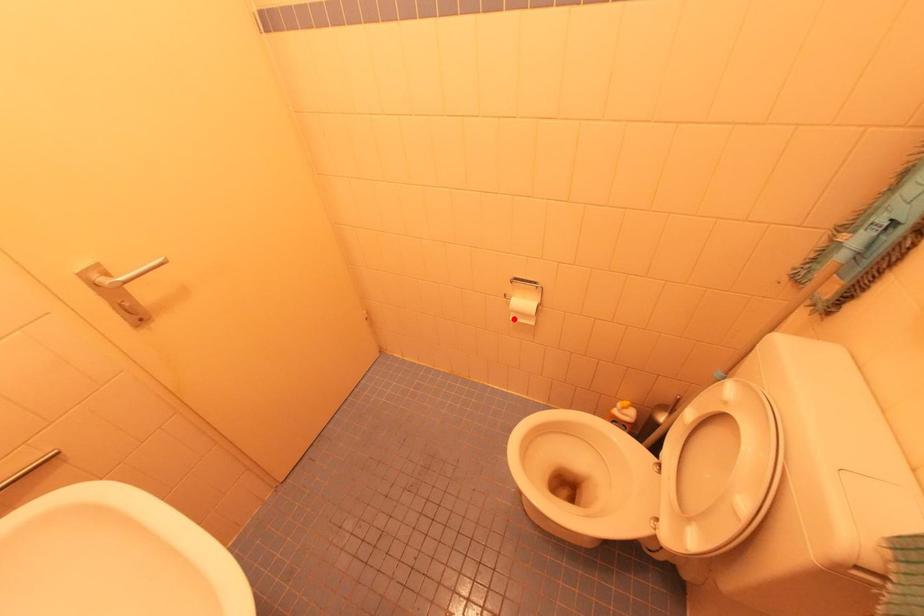
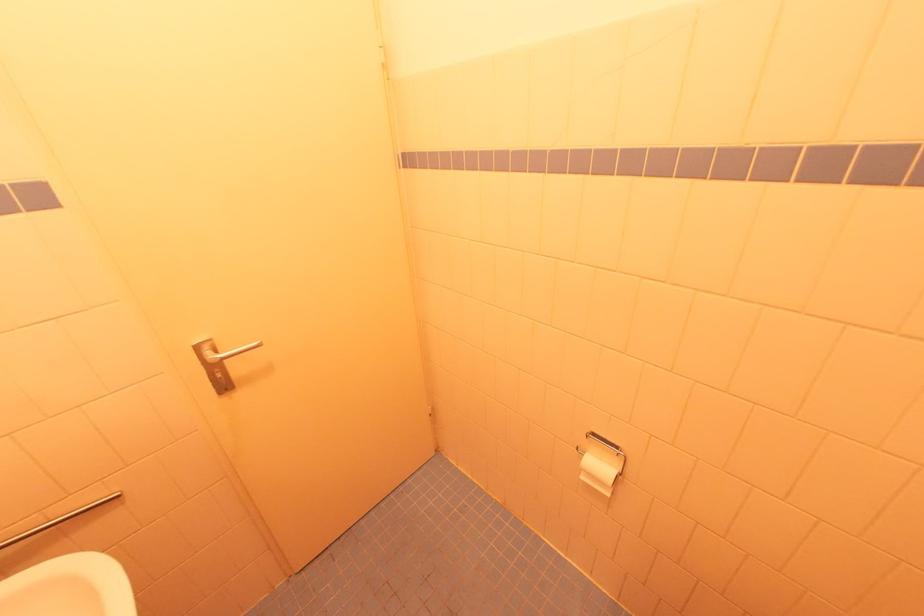
Where in the second image is the point corresponding to the highlighted location from the first image?

(585, 479)